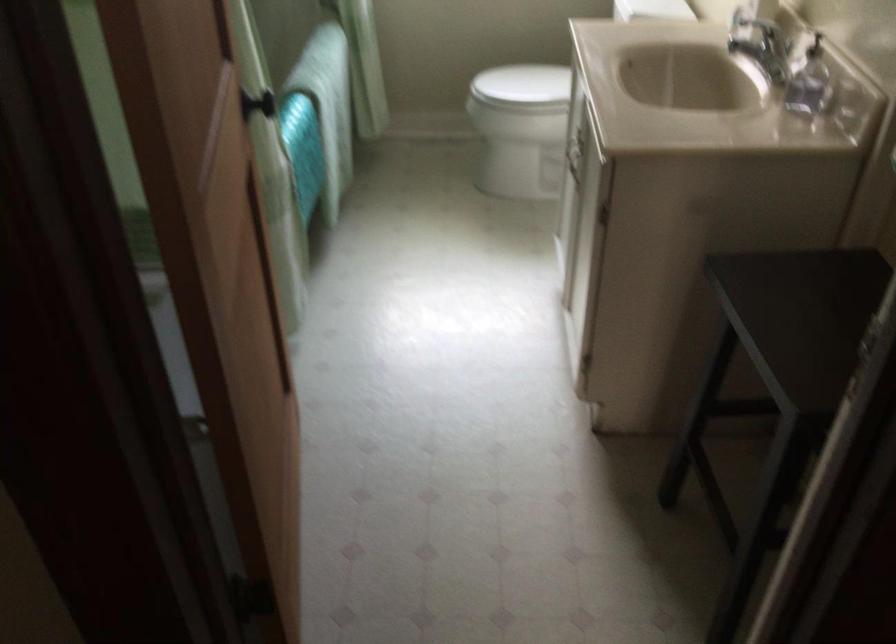
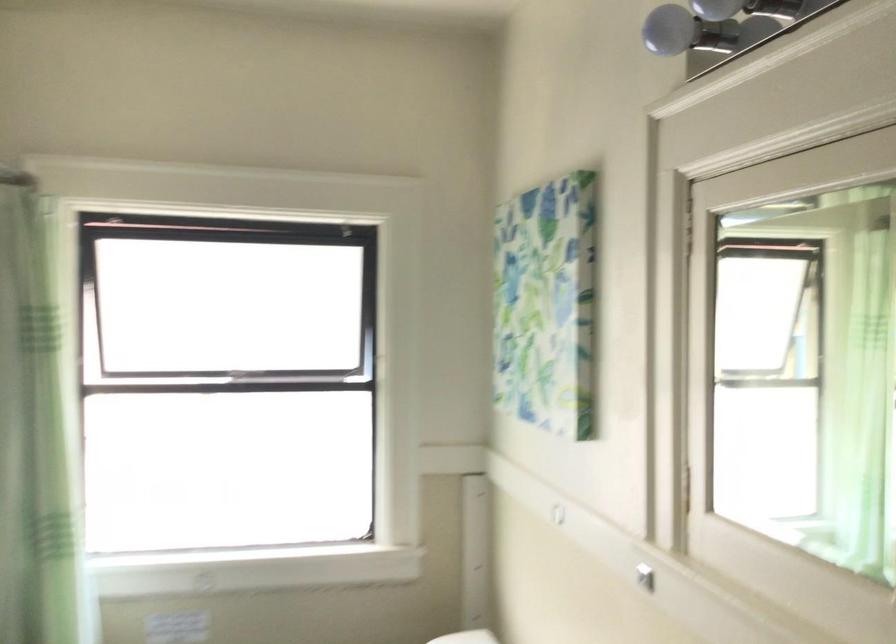
How did the camera likely rotate?

The camera rotated toward right-up.